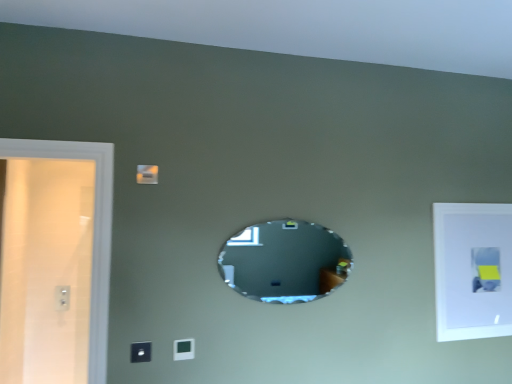
Question: Is satin black switch at lower center, which appears as the first light switch when viewed from the front, bigger than matte white light switch at lower center, marked as the first light switch in a back-to-front arrangement?

Choices:
 (A) yes
 (B) no

Answer: (A)

Question: Is satin black switch at lower center, which appears as the first light switch when viewed from the front, wider than matte white light switch at lower center, marked as the first light switch in a back-to-front arrangement?

Choices:
 (A) no
 (B) yes

Answer: (B)

Question: Is satin black switch at lower center, the 2th light switch from the back, closer to camera compared to matte white light switch at lower center, marked as the first light switch in a back-to-front arrangement?

Choices:
 (A) yes
 (B) no

Answer: (A)

Question: From the image's perspective, is satin black switch at lower center, which appears as the first light switch when viewed from the front, below matte white light switch at lower center, marked as the first light switch in a back-to-front arrangement?

Choices:
 (A) no
 (B) yes

Answer: (A)

Question: Is satin black switch at lower center, acting as the 2th light switch starting from the right, positioned with its back to matte white light switch at lower center, marked as the first light switch in a back-to-front arrangement?

Choices:
 (A) no
 (B) yes

Answer: (A)

Question: Is satin black switch at lower center, acting as the 2th light switch starting from the right, at the left side of matte white light switch at lower center, marked as the first light switch in a back-to-front arrangement?

Choices:
 (A) no
 (B) yes

Answer: (B)

Question: Is white matte picture frame at upper right next to white plastic electric outlet at left?

Choices:
 (A) no
 (B) yes

Answer: (A)

Question: Is white matte picture frame at upper right not close to white plastic electric outlet at left?

Choices:
 (A) yes
 (B) no

Answer: (A)

Question: From the image's perspective, is white matte picture frame at upper right below white plastic electric outlet at left?

Choices:
 (A) yes
 (B) no

Answer: (B)

Question: Does white matte picture frame at upper right have a lesser height compared to white plastic electric outlet at left?

Choices:
 (A) yes
 (B) no

Answer: (B)

Question: Can you confirm if white matte picture frame at upper right is taller than white plastic electric outlet at left?

Choices:
 (A) yes
 (B) no

Answer: (A)

Question: Is white matte picture frame at upper right aimed at white plastic electric outlet at left?

Choices:
 (A) yes
 (B) no

Answer: (B)

Question: Does oval mirror at center appear on the left side of white matte picture frame at upper right?

Choices:
 (A) yes
 (B) no

Answer: (A)